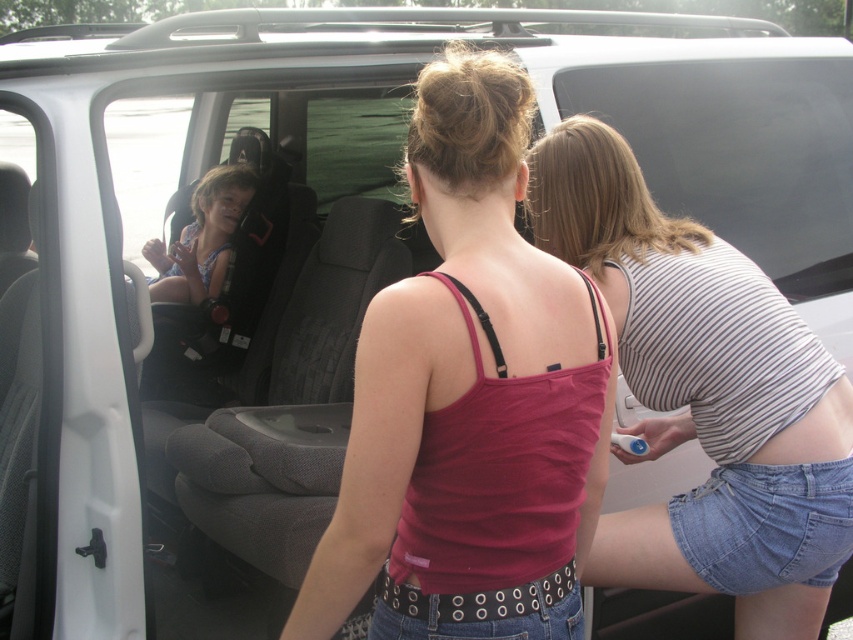
You are standing in front of the van and want to point out two specific points inside the van. The first point is at coordinates point (798, 384) and the second point is at point (229, 172). Which of these two points is closer to you?

Point (798, 384) is closer to the camera than point (229, 172), so the first point is closer to you.

In the scene shown: You are at a beach and see two people wearing the striped cotton tank top at center and the matte blue swimsuit at center. Which clothing item is closer to you?

The striped cotton tank top at center is closer to you because it is in front of the matte blue swimsuit at center.

Looking at the two individuals inside the van, which one is wearing the pink fabric tank top at center and positioned to the left of the striped cotton tank top at center?

The pink fabric tank top at center is to the left of the striped cotton tank top at center.